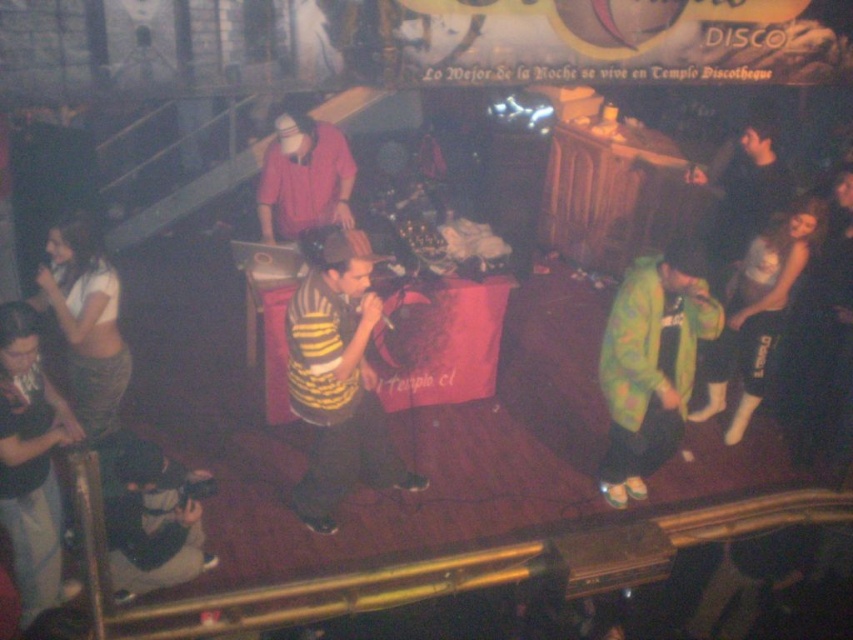
You are a dancer preparing to move from the stage to the dance floor. You need to pass between the green matte jacket at lower right and the white fabric skirt at lower left. Can you estimate if there is enough space for you to walk through comfortably?

The green matte jacket at lower right might be wider than white fabric skirt at lower left, so the space between them could be narrow. It might be tight for comfortable passage, so proceed with caution.

You are a photographer at the back of the nightclub. You want to take a photo of both the yellow striped shirt at center and the matte pink shirt at center without any obstruction. Based on their positions, which one should you focus on first to ensure both are visible in the frame?

The yellow striped shirt at center is located below the matte pink shirt at center, so you should focus on the matte pink shirt at center first to ensure both are visible in the frame.

You are a photographer in the nightclub. You need to capture a photo where both the yellow striped shirt at center and the matte pink shirt at center are visible. Given their height difference, which shirt will appear larger in the photo?

The yellow striped shirt at center will appear larger in the photo because it is much taller than the matte pink shirt at center.